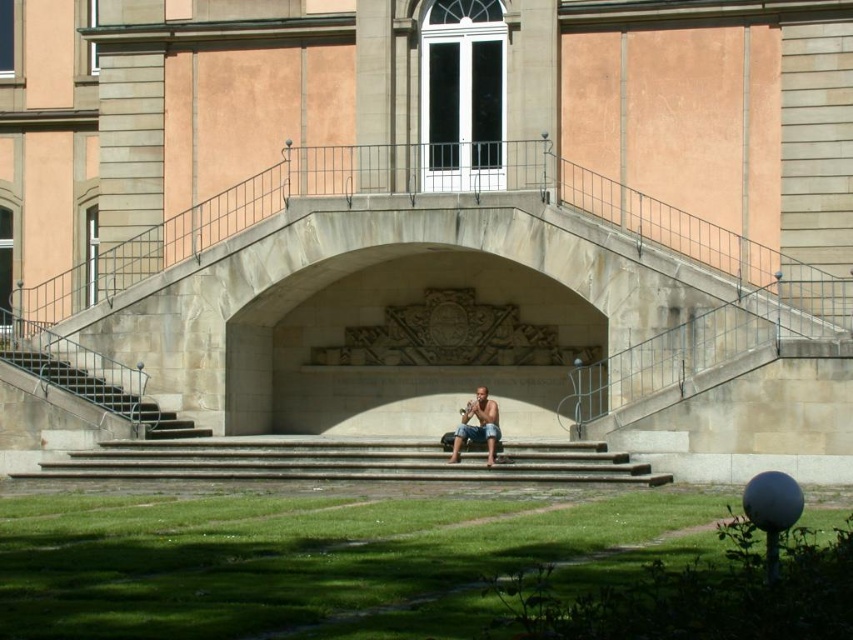
Where is `concrete stairs at center`? This screenshot has height=640, width=853. concrete stairs at center is located at coordinates (341, 461).

Is point (579, 460) positioned behind point (106, 401)?

No, (579, 460) is in front of (106, 401).

Where is `concrete stairs at center`? The width and height of the screenshot is (853, 640). concrete stairs at center is located at coordinates (341, 461).

Consider the image. Does smooth stone stairs at lower left have a larger size compared to tan skin person at center?

Yes.

Does point (113, 403) come behind point (489, 444)?

That is True.

Does point (138, 416) lie behind point (468, 432)?

Yes.

The image size is (853, 640). Identify the location of smooth stone stairs at lower left. (103, 396).

The height and width of the screenshot is (640, 853). What do you see at coordinates (341, 461) in the screenshot?
I see `concrete stairs at center` at bounding box center [341, 461].

Which is below, concrete stairs at center or tan skin person at center?

concrete stairs at center is lower down.

Is point (334, 476) positioned after point (480, 396)?

No.

This screenshot has width=853, height=640. I want to click on concrete stairs at center, so click(x=341, y=461).